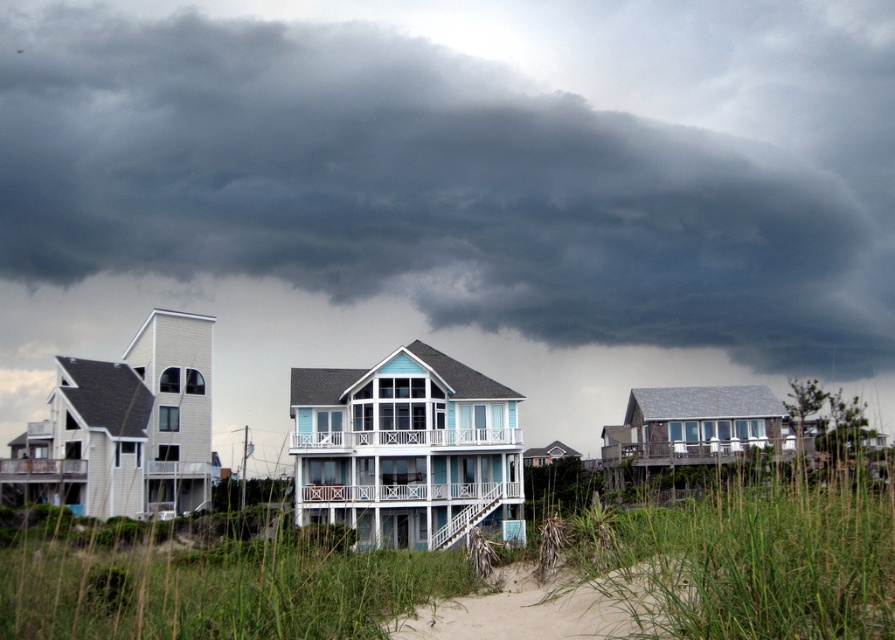
Question: Is dark gray cloud at upper center positioned at the back of sandy beach at lower center?

Choices:
 (A) no
 (B) yes

Answer: (B)

Question: Can you confirm if dark gray cloud at upper center is positioned below sandy beach at lower center?

Choices:
 (A) no
 (B) yes

Answer: (A)

Question: Is dark gray cloud at upper center thinner than sandy beach at lower center?

Choices:
 (A) no
 (B) yes

Answer: (A)